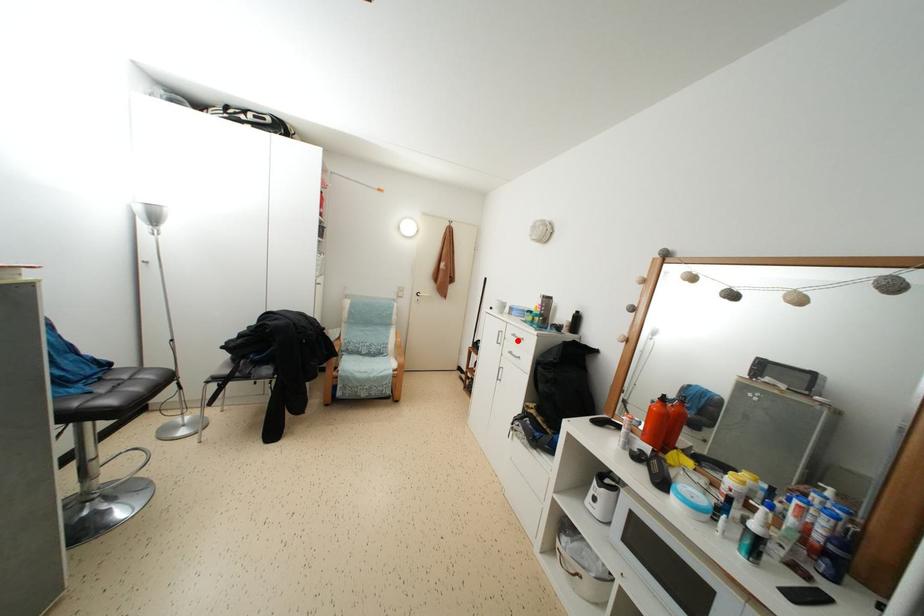
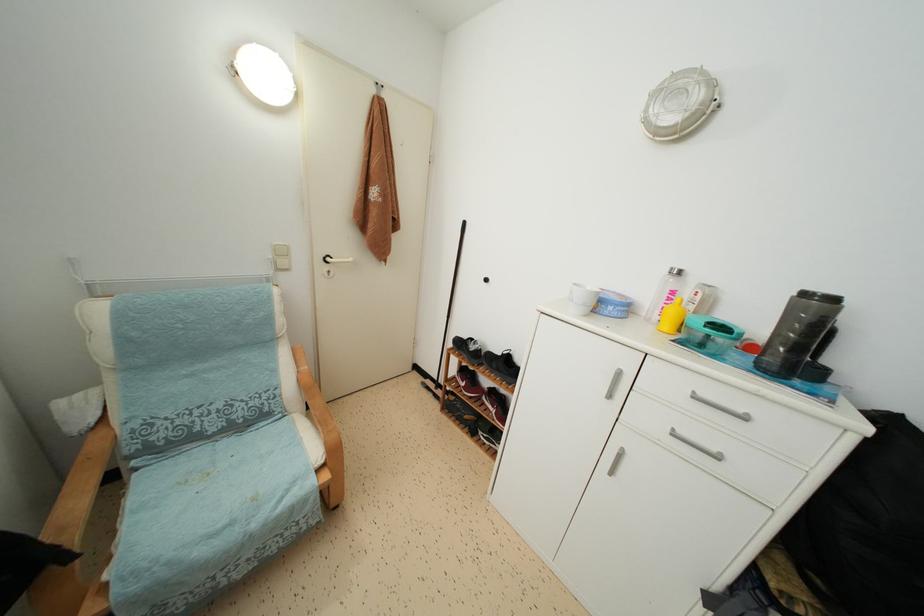
The point at the highlighted location is marked in the first image. Where is the corresponding point in the second image?

(699, 402)